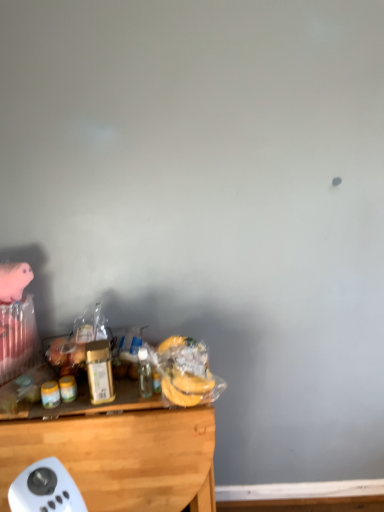
This screenshot has width=384, height=512. In order to click on vacant position to the left of translucent plastic bottle at center, the 2th bottle in the left-to-right sequence in this screenshot , I will do `click(113, 396)`.